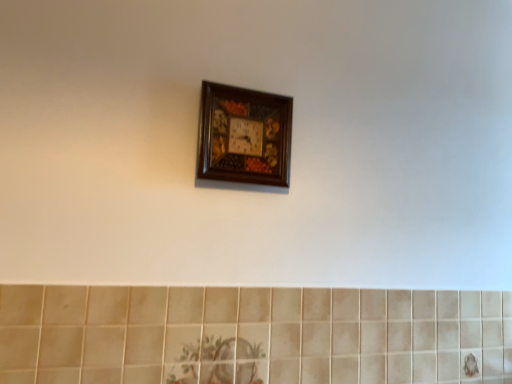
Find the location of a particular element. beige ceramic tile at lower center is located at coordinates (252, 335).

The image size is (512, 384). Describe the element at coordinates (252, 335) in the screenshot. I see `beige ceramic tile at lower center` at that location.

What is the approximate width of wooden clock at upper center?

wooden clock at upper center is 2.26 inches wide.

What do you see at coordinates (244, 136) in the screenshot?
I see `wooden clock at upper center` at bounding box center [244, 136].

Find the location of `wooden clock at upper center`. wooden clock at upper center is located at coordinates 244,136.

At what (x,y) coordinates should I click in order to perform the action: click on beige ceramic tile at lower center. Please return your answer as a coordinate pair (x, y). The width and height of the screenshot is (512, 384). Looking at the image, I should click on (252, 335).

Does beige ceramic tile at lower center appear on the left side of wooden clock at upper center?

In fact, beige ceramic tile at lower center is to the right of wooden clock at upper center.

Consider the image. Is beige ceramic tile at lower center in front of or behind wooden clock at upper center in the image?

In the image, beige ceramic tile at lower center appears in front of wooden clock at upper center.

Which is closer to the camera, (333, 368) or (233, 157)?

Point (333, 368) is farther from the camera than point (233, 157).

From the image's perspective, does beige ceramic tile at lower center appear higher than wooden clock at upper center?

Incorrect, from the image's perspective, beige ceramic tile at lower center is lower than wooden clock at upper center.

From a real-world perspective, is beige ceramic tile at lower center physically above wooden clock at upper center?

No, from a real-world perspective, beige ceramic tile at lower center is not on top of wooden clock at upper center.

Does beige ceramic tile at lower center have a greater width compared to wooden clock at upper center?

No, beige ceramic tile at lower center is not wider than wooden clock at upper center.

Can you confirm if beige ceramic tile at lower center is taller than wooden clock at upper center?

Correct, beige ceramic tile at lower center is much taller as wooden clock at upper center.

Considering the sizes of objects beige ceramic tile at lower center and wooden clock at upper center in the image provided, who is smaller, beige ceramic tile at lower center or wooden clock at upper center?

wooden clock at upper center.

Can wooden clock at upper center be found inside beige ceramic tile at lower center?

No, wooden clock at upper center is not inside beige ceramic tile at lower center.

Is beige ceramic tile at lower center not close to wooden clock at upper center?

No, beige ceramic tile at lower center is in close proximity to wooden clock at upper center.

Is beige ceramic tile at lower center oriented towards wooden clock at upper center?

No, beige ceramic tile at lower center is not turned towards wooden clock at upper center.

Locate an element on the screen. This screenshot has width=512, height=384. picture frame above the beige ceramic tile at lower center (from a real-world perspective) is located at coordinates (244, 136).

Is wooden clock at upper center at the left side of beige ceramic tile at lower center?

Indeed, wooden clock at upper center is positioned on the left side of beige ceramic tile at lower center.

Is wooden clock at upper center positioned before beige ceramic tile at lower center?

No.

Between point (238, 104) and point (386, 332), which one is positioned behind?

The point (386, 332) is farther from the camera.

From the image's perspective, does wooden clock at upper center appear higher than beige ceramic tile at lower center?

Yes, from the image's perspective, wooden clock at upper center is on top of beige ceramic tile at lower center.

From a real-world perspective, is wooden clock at upper center positioned above or below beige ceramic tile at lower center?

In terms of real-world spatial position, wooden clock at upper center is above beige ceramic tile at lower center.

Is wooden clock at upper center thinner than beige ceramic tile at lower center?

No, wooden clock at upper center is not thinner than beige ceramic tile at lower center.

Can you confirm if wooden clock at upper center is taller than beige ceramic tile at lower center?

In fact, wooden clock at upper center may be shorter than beige ceramic tile at lower center.

Which of these two, wooden clock at upper center or beige ceramic tile at lower center, is smaller?

Smaller between the two is wooden clock at upper center.

From the picture: Is wooden clock at upper center inside the boundaries of beige ceramic tile at lower center, or outside?

wooden clock at upper center cannot be found inside beige ceramic tile at lower center.

Would you say wooden clock at upper center is a long distance from beige ceramic tile at lower center?

They are positioned close to each other.

Is wooden clock at upper center oriented towards beige ceramic tile at lower center?

→ No, wooden clock at upper center is not aimed at beige ceramic tile at lower center.

What's the angular difference between wooden clock at upper center and beige ceramic tile at lower center's facing directions?

They differ by 0.367 degrees in their facing directions.

Image resolution: width=512 pixels, height=384 pixels. In order to click on picture frame that is above the beige ceramic tile at lower center (from the image's perspective) in this screenshot , I will do `click(244, 136)`.

You are a GUI agent. You are given a task and a screenshot of the screen. Output one action in this format:
    pyautogui.click(x=<x>, y=<y>)
    Task: Click on the picture frame lying above the beige ceramic tile at lower center (from the image's perspective)
    This screenshot has height=384, width=512.
    Given the screenshot: What is the action you would take?
    pyautogui.click(x=244, y=136)

Locate an element on the screen. The image size is (512, 384). ceramic tile in front of the wooden clock at upper center is located at coordinates 252,335.